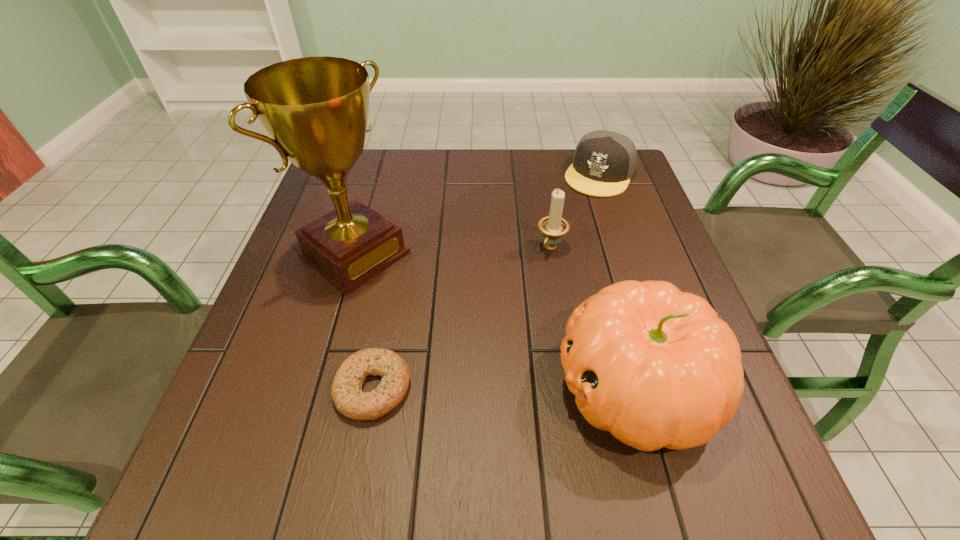
Locate an element on the screen. This screenshot has width=960, height=540. vacant space on the desktop that is between the bagel and the fourth shortest object and is positioned on the handle side of the third tallest object is located at coordinates (468, 387).

Where is `free space on the desktop that is between the shortest object and the pumpkin and is positioned on the front-facing side of the fourth tallest object`? The height and width of the screenshot is (540, 960). free space on the desktop that is between the shortest object and the pumpkin and is positioned on the front-facing side of the fourth tallest object is located at coordinates (471, 387).

Locate an element on the screen. The image size is (960, 540). free space on the desktop that is between the bagel and the pumpkin and is positioned on the plaque of the award is located at coordinates (524, 387).